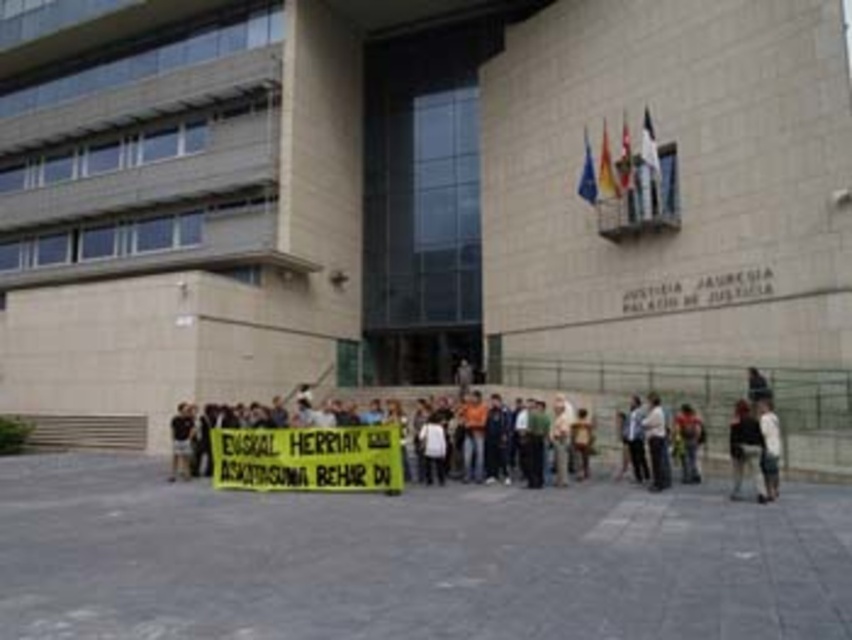
Is dark gray pants at center shorter than white cotton shirt at lower right?

In fact, dark gray pants at center may be taller than white cotton shirt at lower right.

Consider the image. Between dark gray pants at center and white cotton shirt at lower right, which one has more height?

With more height is dark gray pants at center.

Which is behind, point (660, 420) or point (774, 424)?

The point (660, 420) is more distant.

Find the location of a particular element. This screenshot has width=852, height=640. dark gray pants at center is located at coordinates (655, 442).

This screenshot has width=852, height=640. Describe the element at coordinates (308, 458) in the screenshot. I see `yellow fabric banner at center` at that location.

Can you confirm if yellow fabric banner at center is positioned to the right of dark gray fabric jacket at lower right?

No, yellow fabric banner at center is not to the right of dark gray fabric jacket at lower right.

Is point (357, 467) positioned after point (734, 497)?

Yes, point (357, 467) is farther from viewer.

Identify the location of yellow fabric banner at center. The width and height of the screenshot is (852, 640). (308, 458).

Does point (353, 458) lie behind point (776, 429)?

Yes.

The height and width of the screenshot is (640, 852). What do you see at coordinates (308, 458) in the screenshot?
I see `yellow fabric banner at center` at bounding box center [308, 458].

The image size is (852, 640). Find the location of `yellow fabric banner at center`. yellow fabric banner at center is located at coordinates (308, 458).